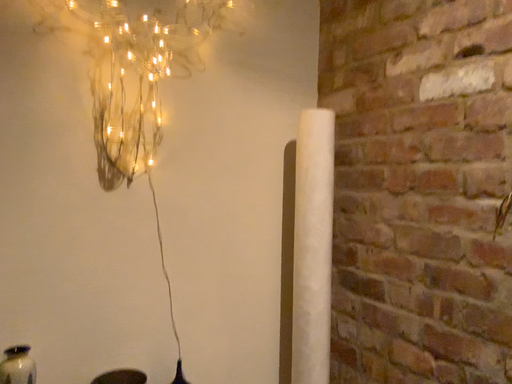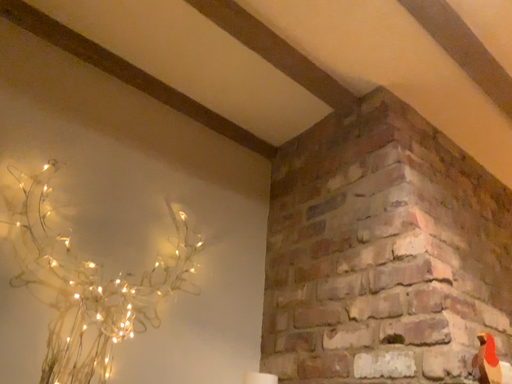
Question: Which way did the camera rotate in the video?

Choices:
 (A) rotated downward
 (B) rotated upward

Answer: (B)